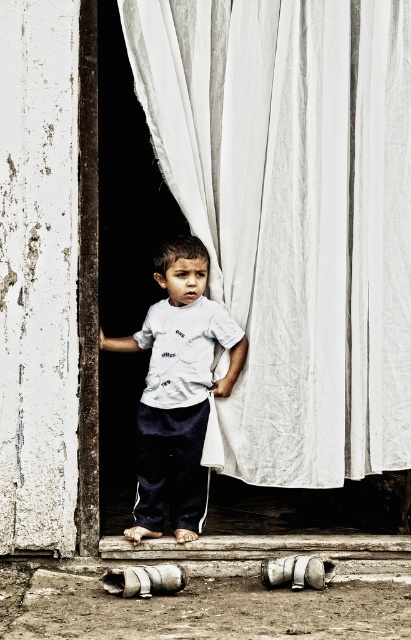
Who is higher up, white fabric curtain at center or white cotton shirt at center?

Positioned higher is white fabric curtain at center.

What do you see at coordinates (293, 214) in the screenshot? I see `white fabric curtain at center` at bounding box center [293, 214].

Is point (226, 198) behind point (154, 268)?

No, it is in front of (154, 268).

Locate an element on the screen. Image resolution: width=411 pixels, height=640 pixels. white fabric curtain at center is located at coordinates (293, 214).